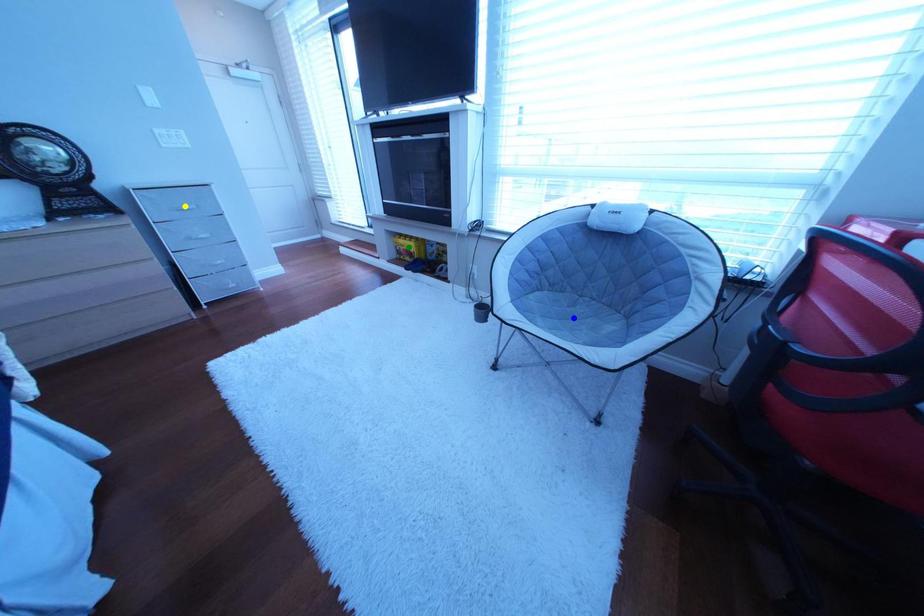
Based on the photo, order these from nearest to farthest:
green point, blue point, yellow point

blue point → yellow point → green point